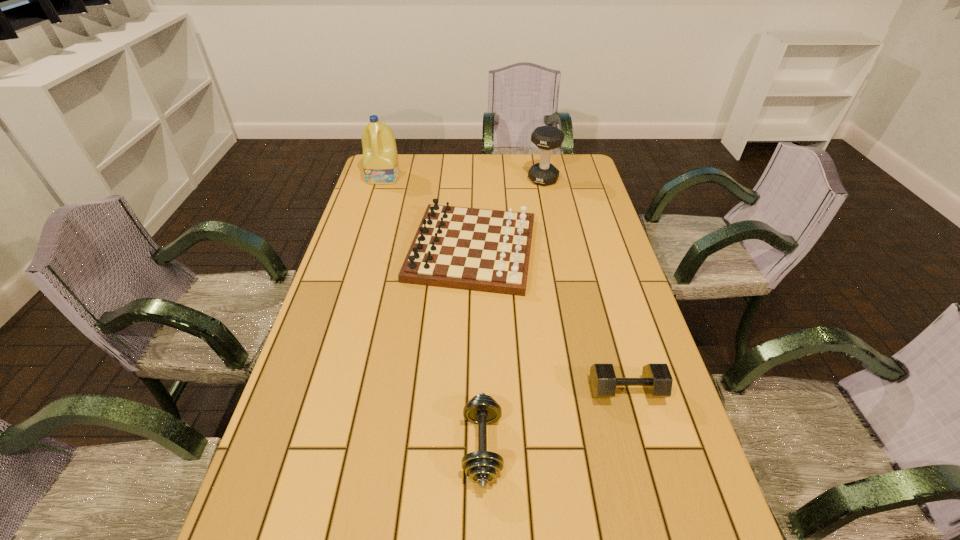
Where is `the third closest object relative to the tallest object`? Image resolution: width=960 pixels, height=540 pixels. the third closest object relative to the tallest object is located at coordinates (482, 467).

I want to click on the closest dumbbell to the third farthest object, so click(546, 138).

Locate which dumbbell is the second closest to the chessboard. Please provide its 2D coordinates. Your answer should be formatted as a tuple, i.e. [(x, y)], where the tuple contains the x and y coordinates of a point satisfying the conditions above.

[(656, 380)]

The height and width of the screenshot is (540, 960). What are the coordinates of `free point that satisfies the following two spatial constraints: 1. on the label of the leftmost dumbbell; 2. on the right side of the detergent` in the screenshot? It's located at (301, 447).

Identify the location of vacant region that satisfies the following two spatial constraints: 1. on the label of the leftmost dumbbell; 2. on the right side of the leftmost object. (301, 447).

You are a GUI agent. You are given a task and a screenshot of the screen. Output one action in this format:
    pyautogui.click(x=<x>, y=<y>)
    Task: Click on the vacant area in the image that satisfies the following two spatial constraints: 1. on the label of the detergent; 2. on the left side of the tallest dumbbell
    
    Given the screenshot: What is the action you would take?
    pyautogui.click(x=383, y=179)

In order to click on vacant space that satisfies the following two spatial constraints: 1. on the label of the tallest object; 2. on the left side of the leftmost dumbbell in this screenshot , I will do `click(301, 447)`.